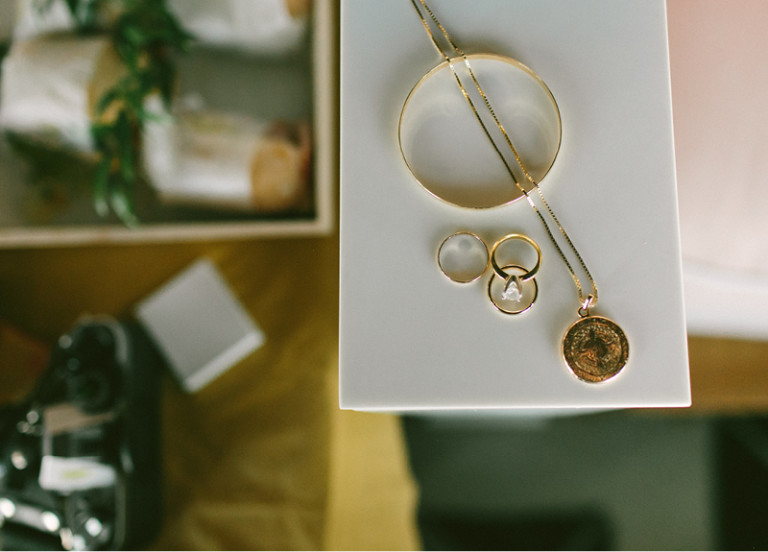
Locate an element on the screen. The height and width of the screenshot is (552, 768). pendant is located at coordinates (584, 330).